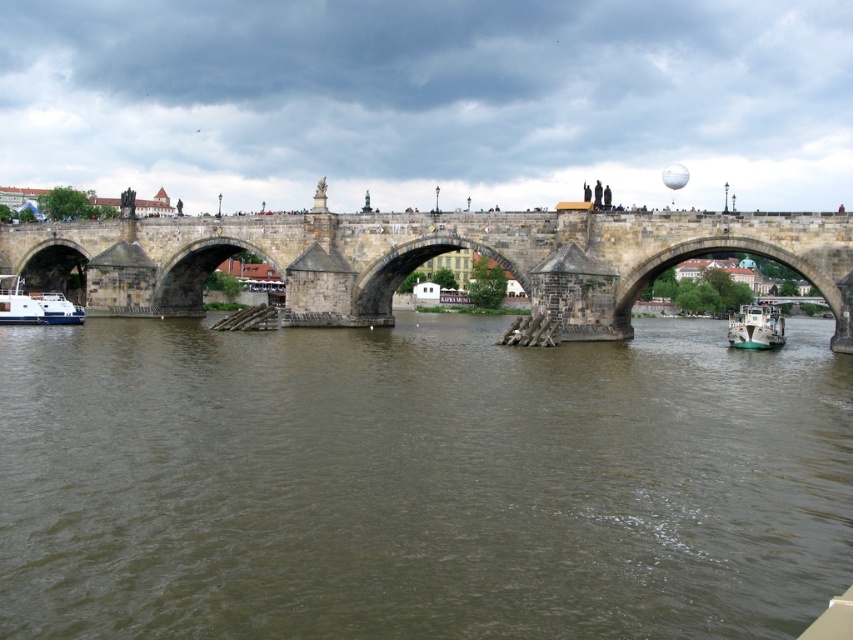
You are standing at the point with coordinates 0.5, 0.5 in the image. Which direction should you move to reach the stone bridge at center?

The stone bridge at center is located at coordinates [424,259]. Since you are at [426,320], you should move slightly to the left and down to reach it.

You are a photographer standing on the historic stone bridge and want to capture a photo of the white glossy boat at lower left and the brown murky water at center. Which object appears larger in the photo?

The brown murky water at center appears larger in the photo because it is much taller than the white glossy boat at lower left according to the description.